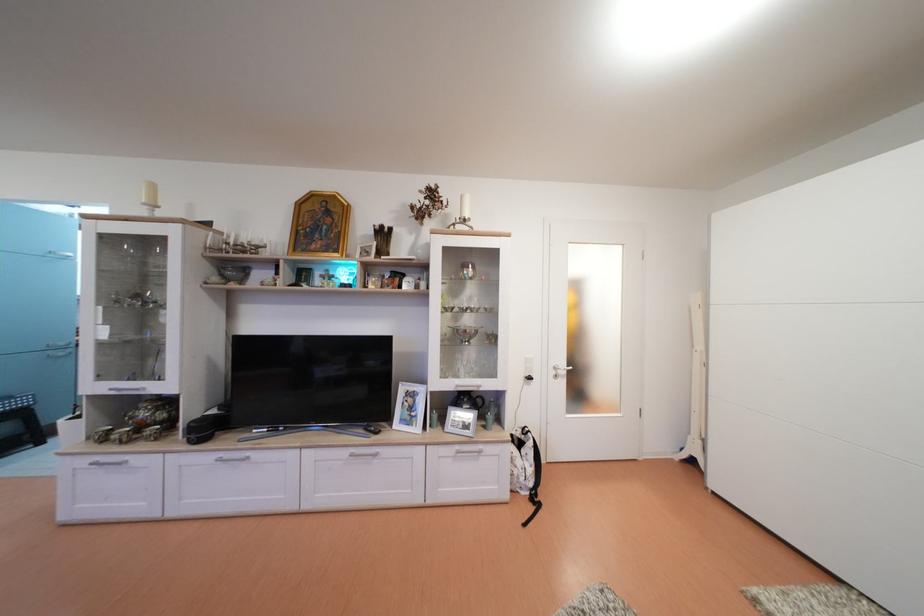
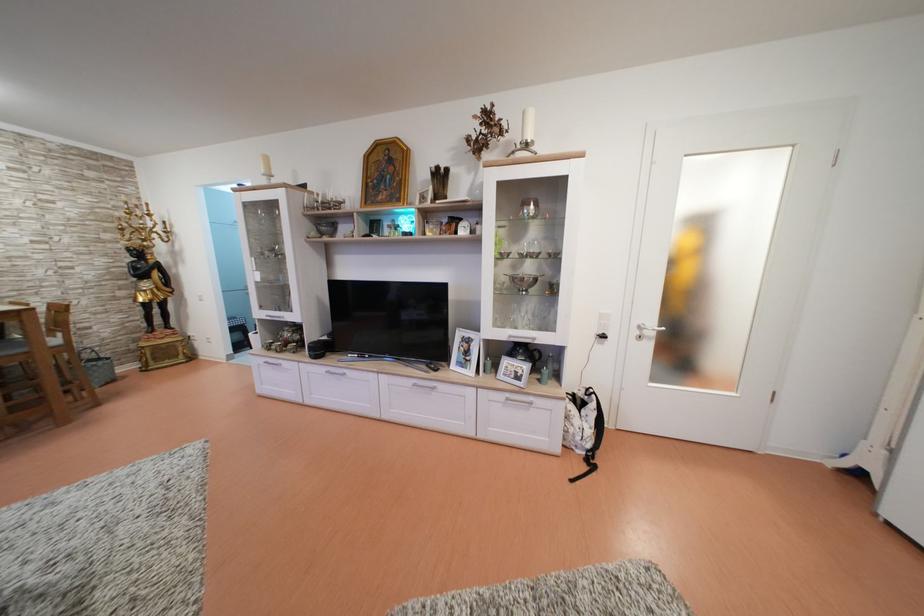
Find the pixel in the second image that matches point 563,373 in the first image.

(647, 333)